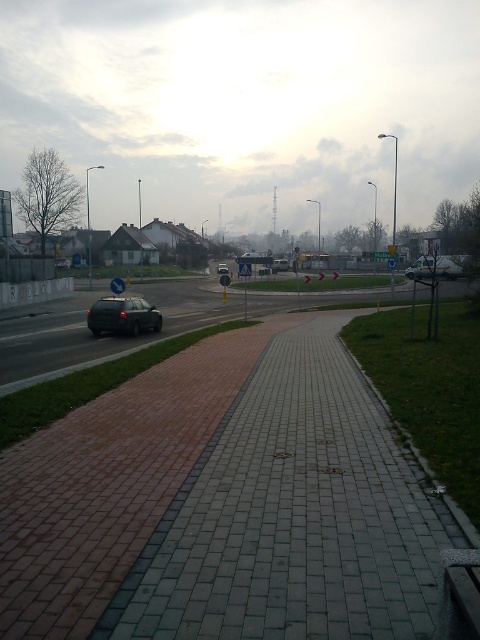
You are standing at the point with coordinates point (x=424, y=276) and want to walk to the point with coordinates point (x=67, y=508). Which direction should you move relative to the roundabout scene?

You should move towards the direction where point (x=67, y=508) is located, which is in front of point (x=424, y=276). Since the roundabout has a curved walkway, moving forward along the curve would lead you toward the desired point.

You are a pedestrian standing on the curved walkway. You see a metallic silver car at center and a black matte car at center. Which car is nearer to you?

The metallic silver car at center is closer to the viewer than the black matte car at center.

You are standing at the center of the roundabout and want to reach the metallic silver car at center. Which direction should you walk to get there?

The metallic silver car at center is located at point (430, 268), so you should walk towards the lower right direction from the center of the roundabout to reach it.